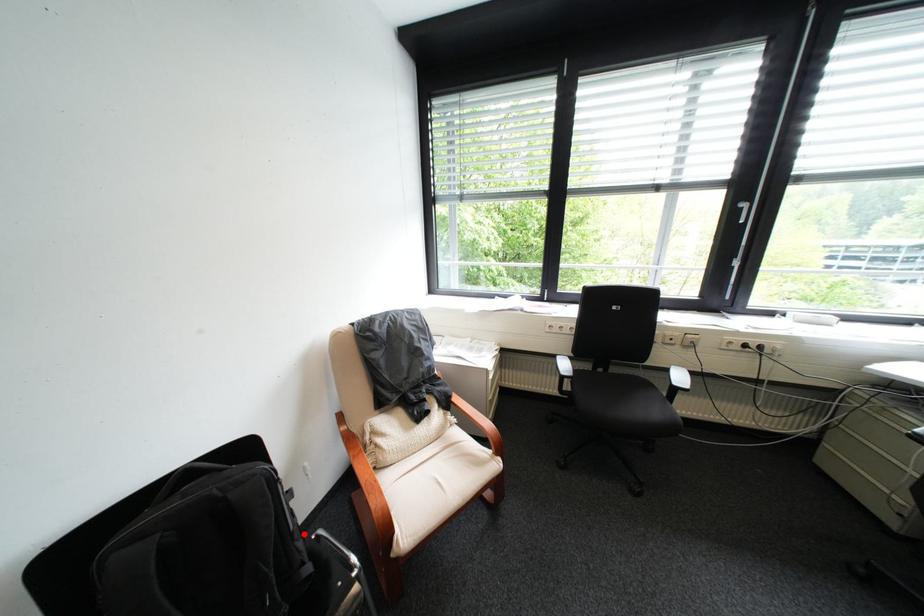
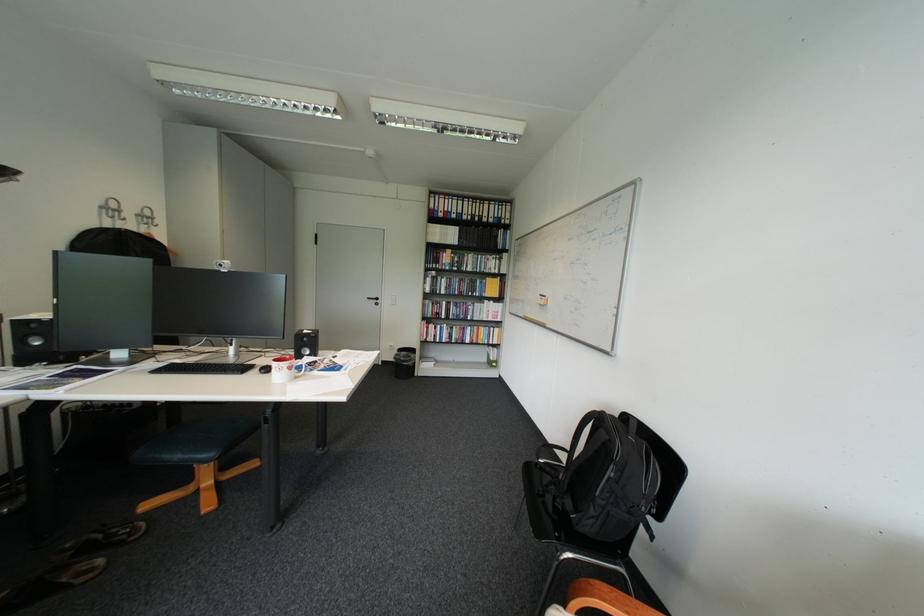
Question: I am providing you with two images of the same scene from different viewpoints. In image1, a red point is highlighted. Considering the same 3D point in image2, which of the following is correct?

Choices:
 (A) It is closer
 (B) It is farther

Answer: (B)